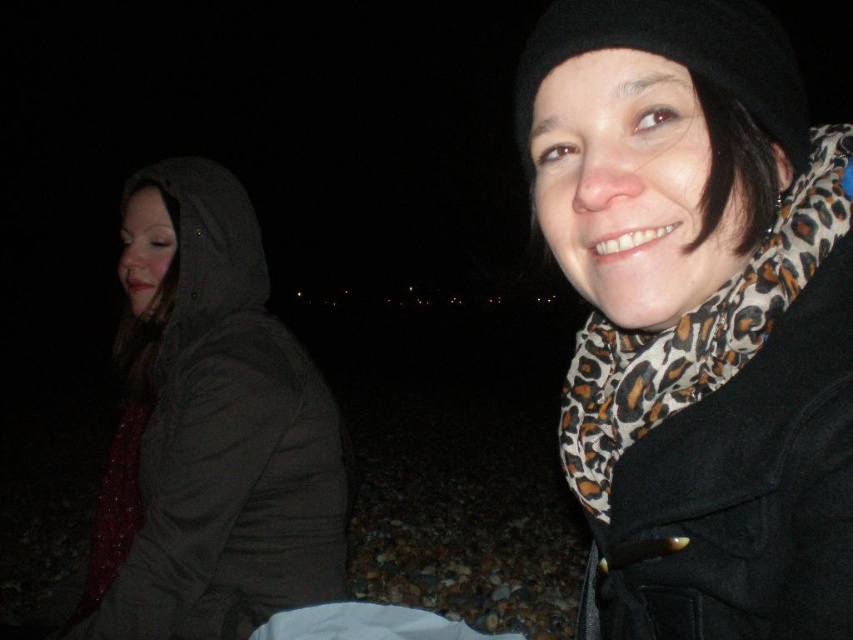
Does dark gray hooded jacket at left lie in front of leopard print scarf at upper right?

No.

You are a GUI agent. You are given a task and a screenshot of the screen. Output one action in this format:
    pyautogui.click(x=<x>, y=<y>)
    Task: Click on the dark gray hooded jacket at left
    
    Given the screenshot: What is the action you would take?
    pyautogui.click(x=213, y=428)